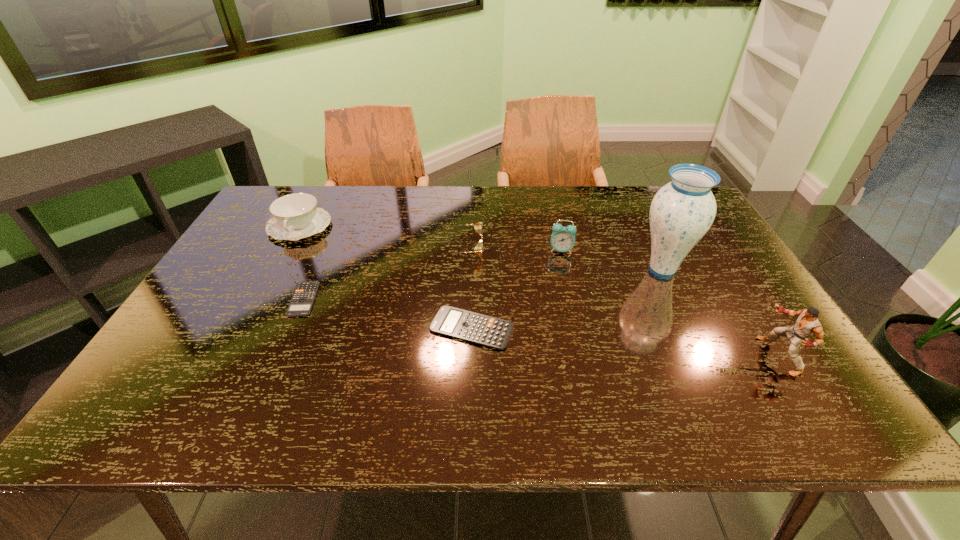
Considering the uniform spacing of calculators, where should an additional calculator be positioned on the right? Please locate a free spot. Please provide its 2D coordinates. Your answer should be formatted as a tuple, i.e. [(x, y)], where the tuple contains the x and y coordinates of a point satisfying the conditions above.

[(665, 361)]